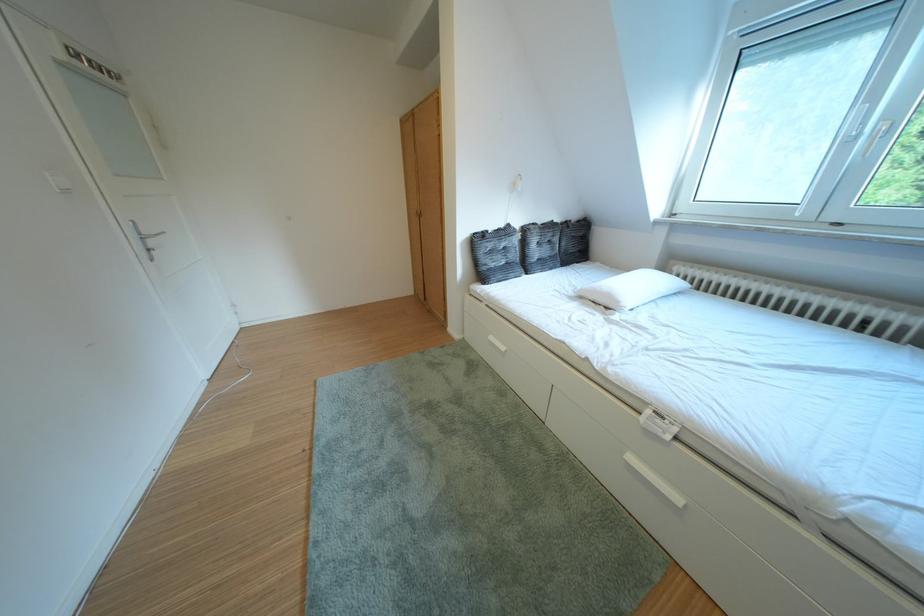
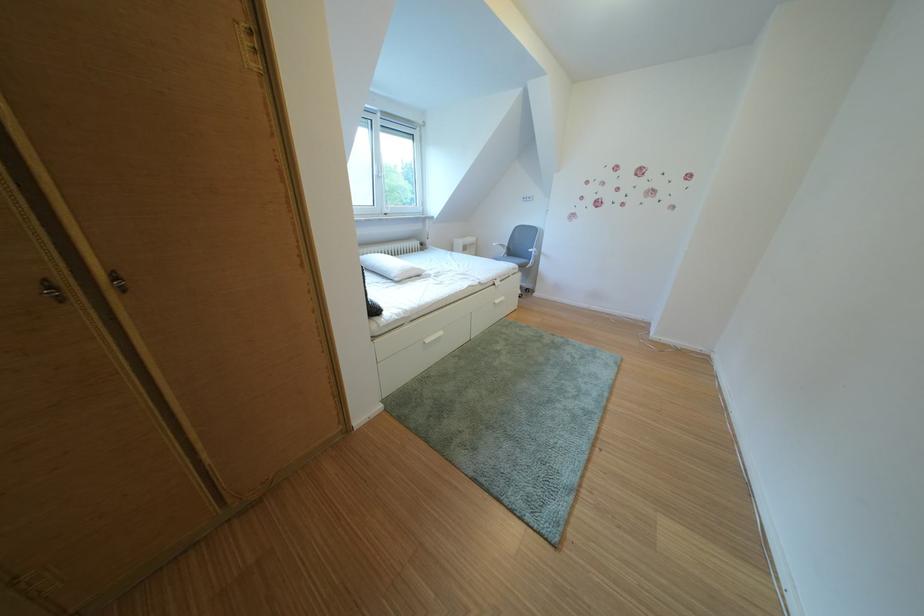
Where in the second image is the point corresponding to [646,464] from the first image?

(511, 307)